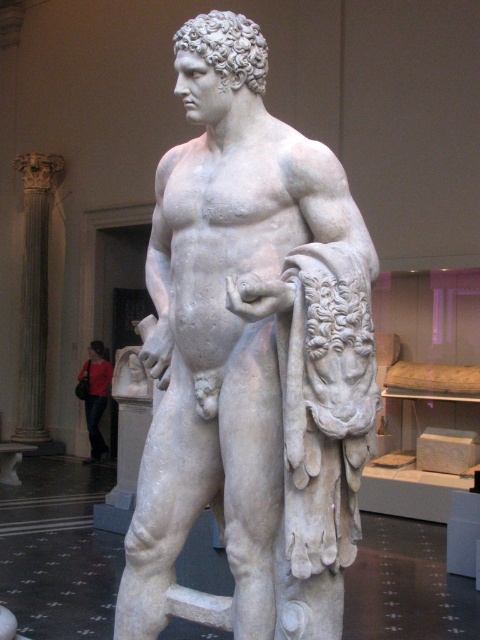
Question: Does white marble statue at center appear on the left side of red fabric bag at lower left?

Choices:
 (A) yes
 (B) no

Answer: (B)

Question: Among these objects, which one is farthest from the camera?

Choices:
 (A) white marble statue at center
 (B) red fabric bag at lower left

Answer: (B)

Question: Which point is farther from the camera taking this photo?

Choices:
 (A) (86, 397)
 (B) (288, 376)

Answer: (A)

Question: Where is white marble statue at center located in relation to red fabric bag at lower left in the image?

Choices:
 (A) below
 (B) above

Answer: (B)

Question: Is white marble statue at center positioned at the back of red fabric bag at lower left?

Choices:
 (A) no
 (B) yes

Answer: (A)